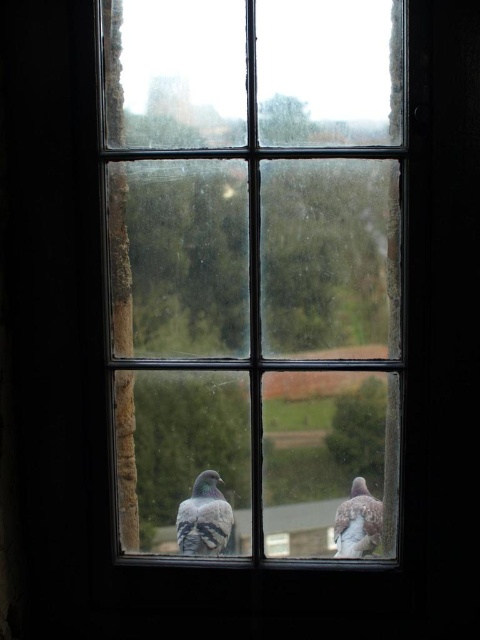
Is clear glass window at center closer to the viewer compared to green matte tree at lower right?

That is True.

Who is more distant from viewer, [236,52] or [351,429]?

Positioned behind is point [351,429].

Which is in front, point (319, 428) or point (383, 467)?

Positioned in front is point (383, 467).

At what (x,y) coordinates should I click in order to perform the action: click on clear glass window at center. Please return your answer as a coordinate pair (x, y). Looking at the image, I should click on (251, 257).

Which is behind, point (358, 422) or point (216, 525)?

Point (216, 525)

Is point (369, 435) less distant than point (220, 522)?

Yes.

Between point (381, 474) and point (223, 500), which one is positioned behind?

Positioned behind is point (223, 500).

Where is `green matte tree at lower right`? This screenshot has height=640, width=480. green matte tree at lower right is located at coordinates (360, 432).

Who is more distant from viewer, (376,483) or (340,531)?

Positioned behind is point (340,531).

Is point (383, 412) positioned after point (364, 540)?

No, it is not.

This screenshot has height=640, width=480. Find the location of `green matte tree at lower right`. green matte tree at lower right is located at coordinates (360, 432).